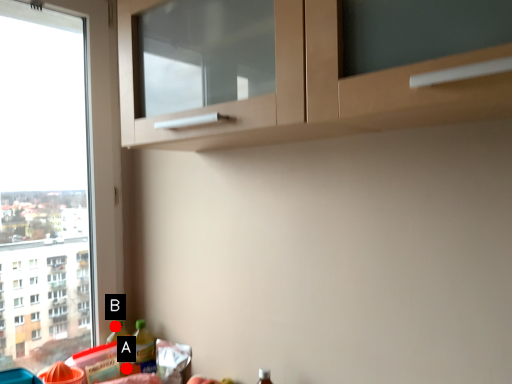
Question: Two points are circled on the image, labeled by A and B beside each circle. Which point appears closest to the camera in this image?

Choices:
 (A) A is closer
 (B) B is closer

Answer: (A)